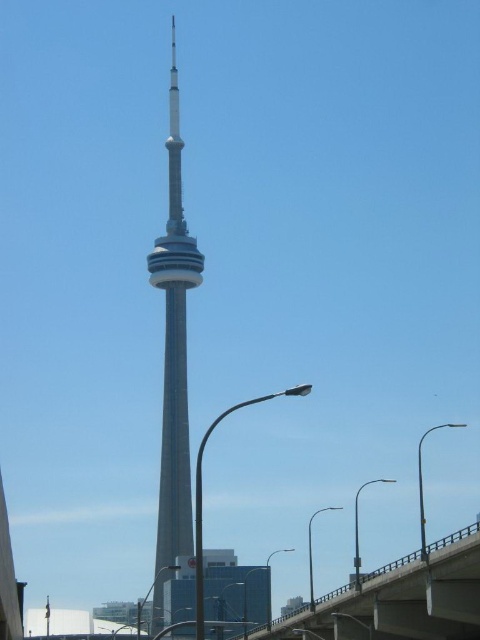
Is point (454, 637) less distant than point (162, 452)?

Yes, point (454, 637) is closer to viewer.

Between metallic gray bridge at lower center and smooth gray tower at center, which one appears on the right side from the viewer's perspective?

From the viewer's perspective, metallic gray bridge at lower center appears more on the right side.

Is point (322, 609) more distant than point (170, 284)?

No.

Where is `metallic gray bridge at lower center`? metallic gray bridge at lower center is located at coordinates (400, 600).